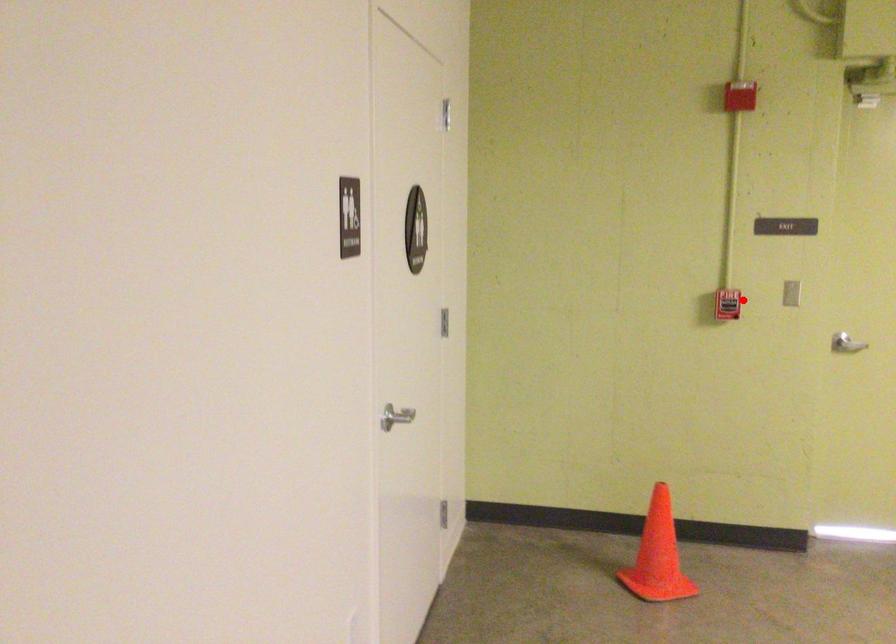
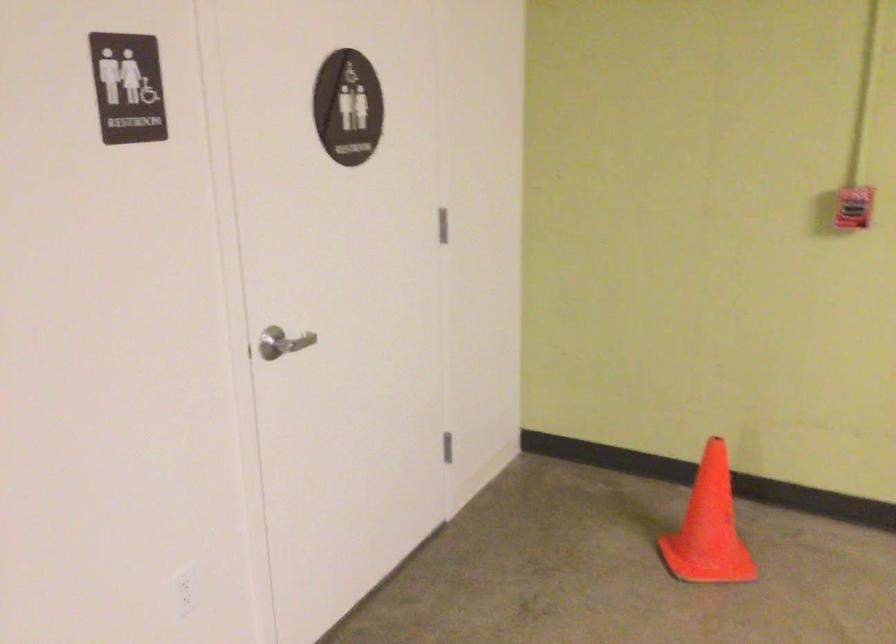
The point at the highlighted location is marked in the first image. Where is the corresponding point in the second image?

(854, 207)